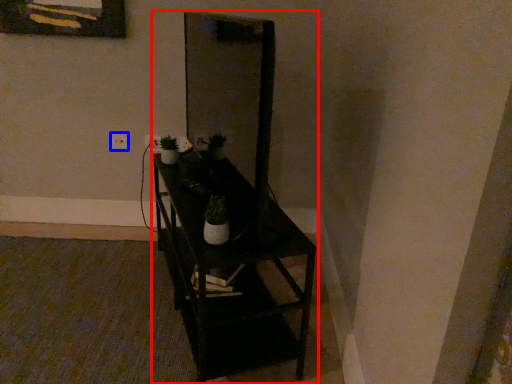
Question: Which point is further to the camera, furniture (highlighted by a red box) or electric outlet (highlighted by a blue box)?

Choices:
 (A) furniture
 (B) electric outlet

Answer: (B)